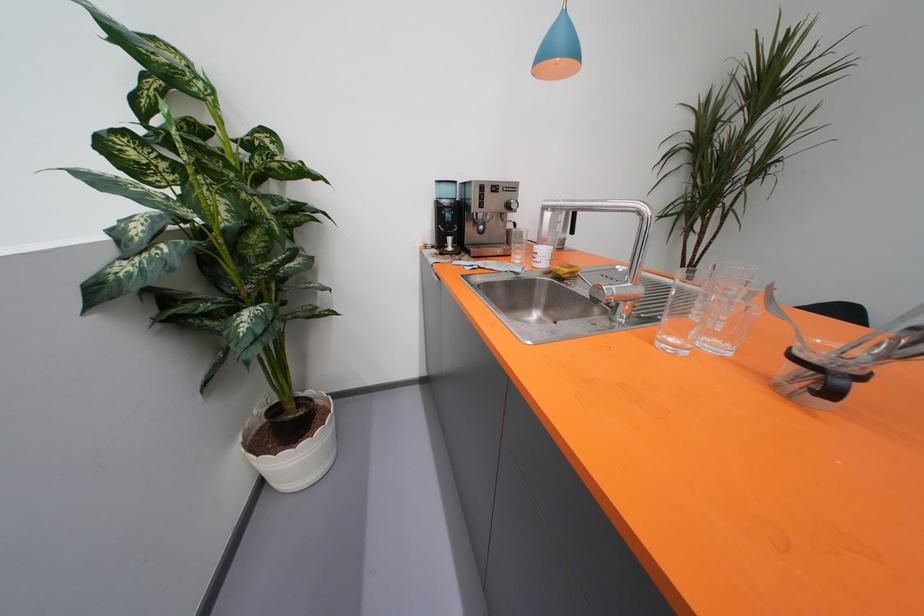
This screenshot has height=616, width=924. I want to click on coffee machine dial, so click(x=511, y=205).